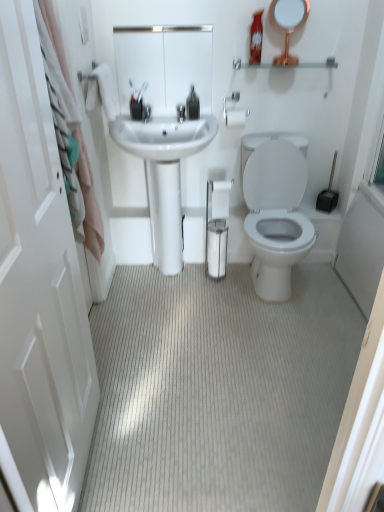
Question: Is clear glass shelf at upper center to the right of white matte toilet paper at center from the viewer's perspective?

Choices:
 (A) no
 (B) yes

Answer: (B)

Question: Can you confirm if clear glass shelf at upper center is smaller than white matte toilet paper at center?

Choices:
 (A) yes
 (B) no

Answer: (B)

Question: Is clear glass shelf at upper center facing away from white matte toilet paper at center?

Choices:
 (A) no
 (B) yes

Answer: (A)

Question: Is clear glass shelf at upper center outside white matte toilet paper at center?

Choices:
 (A) yes
 (B) no

Answer: (A)

Question: Is clear glass shelf at upper center directly adjacent to white matte toilet paper at center?

Choices:
 (A) yes
 (B) no

Answer: (B)

Question: Is the depth of clear glass shelf at upper center less than that of white matte toilet paper at center?

Choices:
 (A) no
 (B) yes

Answer: (B)

Question: Is silver metallic towel bar at upper center looking in the opposite direction of neutral carpet at center?

Choices:
 (A) no
 (B) yes

Answer: (A)

Question: Can you confirm if silver metallic towel bar at upper center is positioned to the left of neutral carpet at center?

Choices:
 (A) yes
 (B) no

Answer: (B)

Question: Is silver metallic towel bar at upper center wider than neutral carpet at center?

Choices:
 (A) yes
 (B) no

Answer: (B)

Question: Does silver metallic towel bar at upper center come behind neutral carpet at center?

Choices:
 (A) no
 (B) yes

Answer: (B)

Question: From a real-world perspective, is silver metallic towel bar at upper center positioned under neutral carpet at center based on gravity?

Choices:
 (A) no
 (B) yes

Answer: (A)

Question: From the image's perspective, is silver metallic towel bar at upper center located above neutral carpet at center?

Choices:
 (A) no
 (B) yes

Answer: (B)

Question: Could you tell me if gold metallic mirror at upper right, which appears as the first mirror when viewed from the right, is turned towards neutral carpet at center?

Choices:
 (A) yes
 (B) no

Answer: (B)